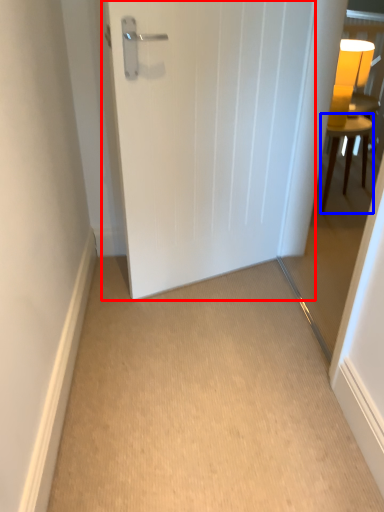
Question: Which of the following is the closest to the observer, door (highlighted by a red box) or furniture (highlighted by a blue box)?

Choices:
 (A) door
 (B) furniture

Answer: (A)